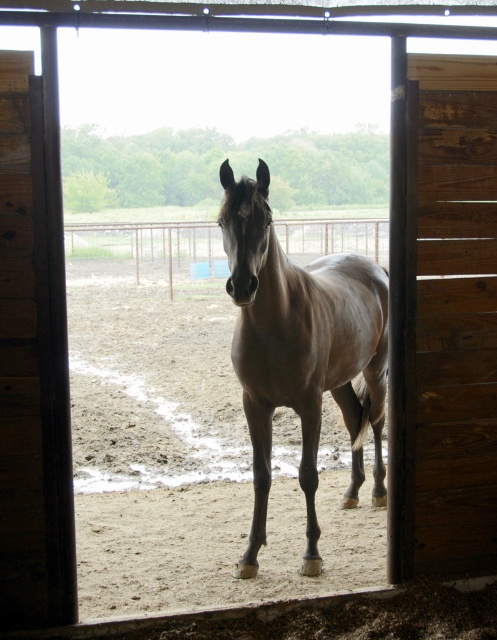
Question: Which of the following is the farthest from the observer?

Choices:
 (A) (327, 278)
 (B) (479, 483)

Answer: (A)

Question: Is brown wooden door at right above brown glossy horse at center?

Choices:
 (A) no
 (B) yes

Answer: (B)

Question: Is brown wooden door at right positioned behind brown glossy horse at center?

Choices:
 (A) yes
 (B) no

Answer: (A)

Question: Which point is farther to the camera?

Choices:
 (A) (256, 381)
 (B) (472, 58)

Answer: (A)

Question: Is brown wooden door at right to the left of brown glossy horse at center from the viewer's perspective?

Choices:
 (A) no
 (B) yes

Answer: (A)

Question: Which point is closer to the camera taking this photo?

Choices:
 (A) (418, 294)
 (B) (309, 326)

Answer: (A)